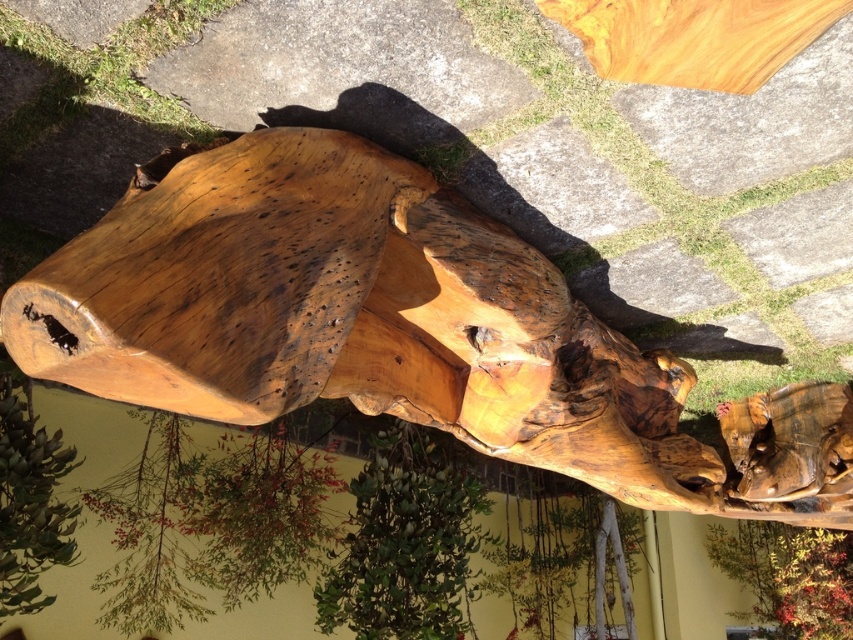
Does natural wood bench at center come in front of green matte tree at center?

That is True.

Between point (735, 410) and point (451, 600), which one is positioned behind?

The point (451, 600) is more distant.

Does point (511, 282) lie behind point (460, 536)?

No, it is not.

In order to click on natural wood bench at center in this screenshot , I will do `click(395, 328)`.

What do you see at coordinates (395, 328) in the screenshot?
I see `natural wood bench at center` at bounding box center [395, 328].

Which is behind, point (247, 337) or point (830, 620)?

The point (830, 620) is behind.

Does point (735, 492) come in front of point (779, 572)?

Yes, point (735, 492) is in front of point (779, 572).

At what (x,y) coordinates should I click in order to perform the action: click on natural wood bench at center. Please return your answer as a coordinate pair (x, y). This screenshot has width=853, height=640. Looking at the image, I should click on (395, 328).

Is green matte tree at center below natural wood tree trunk at lower left?

Yes, green matte tree at center is below natural wood tree trunk at lower left.

Which is behind, point (410, 529) or point (15, 547)?

Point (410, 529)

Who is more forward, (329, 552) or (24, 529)?

Positioned in front is point (24, 529).

Find the location of a particular element. The image size is (853, 640). green matte tree at center is located at coordinates (405, 544).